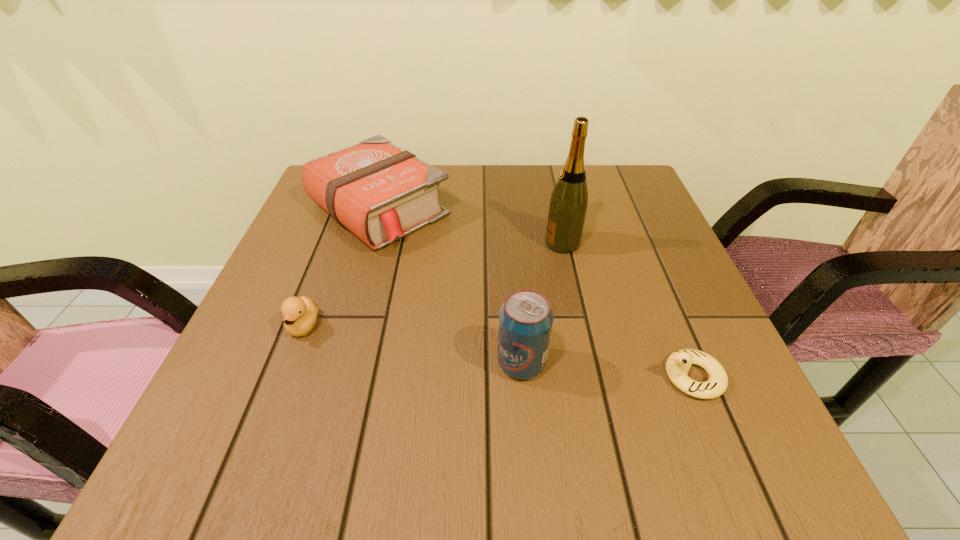
The width and height of the screenshot is (960, 540). I want to click on empty location between the farther duckling and the third shortest object, so click(342, 268).

Where is `empty location between the left duckling and the third object from right to left`? empty location between the left duckling and the third object from right to left is located at coordinates pos(413,345).

What are the coordinates of `vacant area that lies between the Bible and the second shortest object` in the screenshot? It's located at (342, 268).

Find the location of a particular element. free point between the fourth shortest object and the shorter duckling is located at coordinates (607, 370).

Find the location of `free spot between the right duckling and the fourth object from left to right`. free spot between the right duckling and the fourth object from left to right is located at coordinates (627, 310).

I want to click on vacant region between the third tallest object and the fourth tallest object, so click(x=342, y=268).

Choose which object is the third nearest neighbor to the Bible. Please provide its 2D coordinates. Your answer should be formatted as a tuple, i.e. [(x, y)], where the tuple contains the x and y coordinates of a point satisfying the conditions above.

[(525, 319)]

Select which object is the second closest to the fourth shortest object. Please provide its 2D coordinates. Your answer should be formatted as a tuple, i.e. [(x, y)], where the tuple contains the x and y coordinates of a point satisfying the conditions above.

[(568, 204)]

The image size is (960, 540). I want to click on vacant area in the image that satisfies the following two spatial constraints: 1. on the front-facing side of the wine bottle; 2. on the front side of the pop soda, so click(588, 363).

In order to click on vacant region that satisfies the following two spatial constraints: 1. on the front-facing side of the wine bottle; 2. facing forward on the left duckling in this screenshot , I will do `click(581, 326)`.